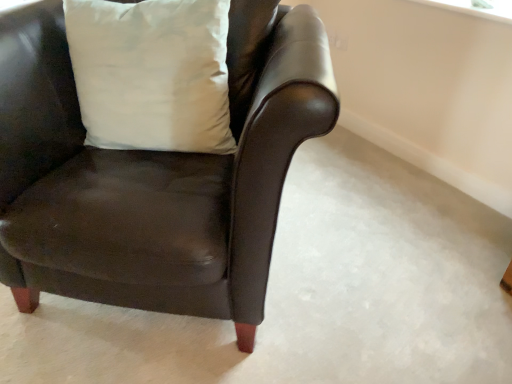
Question: Can you confirm if matte black armchair at center is taller than white matte pillow at upper left?

Choices:
 (A) no
 (B) yes

Answer: (B)

Question: Is matte black armchair at center bigger than white matte pillow at upper left?

Choices:
 (A) no
 (B) yes

Answer: (B)

Question: Considering the relative sizes of matte black armchair at center and white matte pillow at upper left in the image provided, is matte black armchair at center thinner than white matte pillow at upper left?

Choices:
 (A) yes
 (B) no

Answer: (B)

Question: Does matte black armchair at center appear on the left side of white matte pillow at upper left?

Choices:
 (A) yes
 (B) no

Answer: (B)

Question: Is the depth of matte black armchair at center less than that of white matte pillow at upper left?

Choices:
 (A) no
 (B) yes

Answer: (B)

Question: From a real-world perspective, is matte black armchair at center located higher than white matte pillow at upper left?

Choices:
 (A) no
 (B) yes

Answer: (A)

Question: Is the depth of white matte pillow at upper left less than that of matte black armchair at center?

Choices:
 (A) no
 (B) yes

Answer: (A)

Question: Is white matte pillow at upper left smaller than matte black armchair at center?

Choices:
 (A) no
 (B) yes

Answer: (B)

Question: Considering the relative sizes of white matte pillow at upper left and matte black armchair at center in the image provided, is white matte pillow at upper left bigger than matte black armchair at center?

Choices:
 (A) no
 (B) yes

Answer: (A)

Question: Is white matte pillow at upper left far away from matte black armchair at center?

Choices:
 (A) no
 (B) yes

Answer: (A)

Question: Is white matte pillow at upper left taller than matte black armchair at center?

Choices:
 (A) yes
 (B) no

Answer: (B)

Question: Is the depth of white matte pillow at upper left greater than that of matte black armchair at center?

Choices:
 (A) yes
 (B) no

Answer: (A)

Question: Looking at the image, does matte black armchair at center seem bigger or smaller compared to white matte pillow at upper left?

Choices:
 (A) big
 (B) small

Answer: (A)